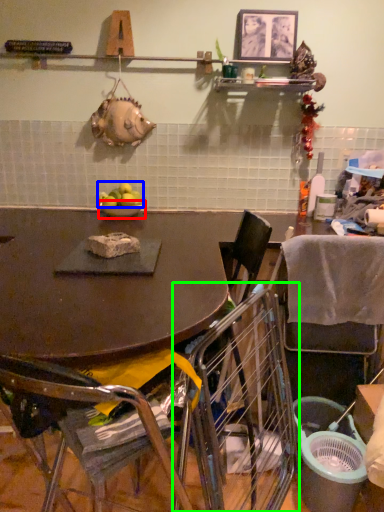
Question: Which object is the farthest from bowl (highlighted by a red box)? Choose among these: apple (highlighted by a blue box) or chair (highlighted by a green box).

Choices:
 (A) apple
 (B) chair

Answer: (B)